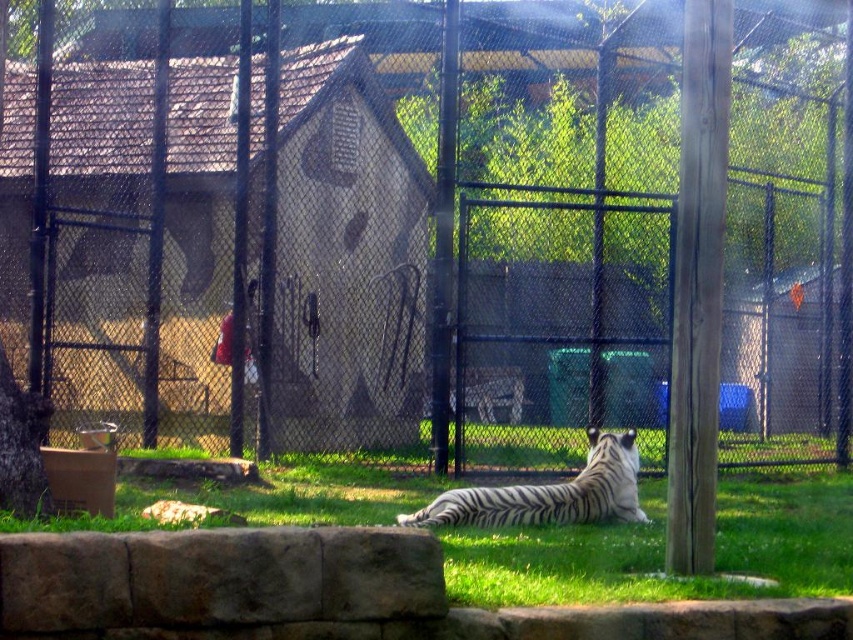
You are a zookeeper who needs to place a new feeding tray for the tiger. The tray must be placed on the green grass at center. Where should you position the tray relative to the metal mesh fence at center?

The metal mesh fence at center is positioned on the left side of green grass at center, so you should place the feeding tray on the right side of the metal mesh fence at center to ensure it is on the green grass at center.

From the picture: You are standing outside a zoo enclosure and want to take a photo of the tiger. The zoo requires visitors to stay at least 30 feet away from the metal mesh fence at center for safety. Are you within the safe distance?

The distance between you and the metal mesh fence at center is 35.91 feet, which exceeds the required 30 feet safety distance. You are within the safe distance.

You are a zookeeper trying to locate the metal mesh fence at center in the zoo enclosure. According to the coordinates provided, where would you find it?

The metal mesh fence at center is located at coordinates point (436, 227).